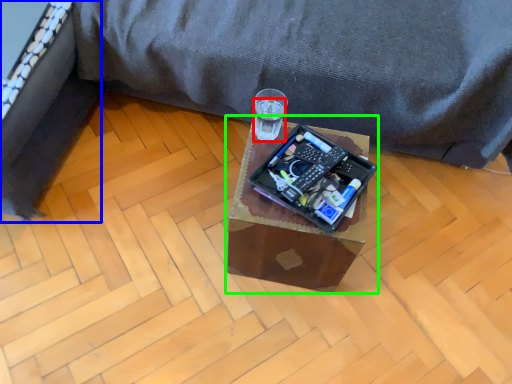
Question: Estimate the real-world distances between objects in this image. Which object is closer to beverage (highlighted by a red box), bed frame (highlighted by a blue box) or table (highlighted by a green box)?

Choices:
 (A) bed frame
 (B) table

Answer: (B)